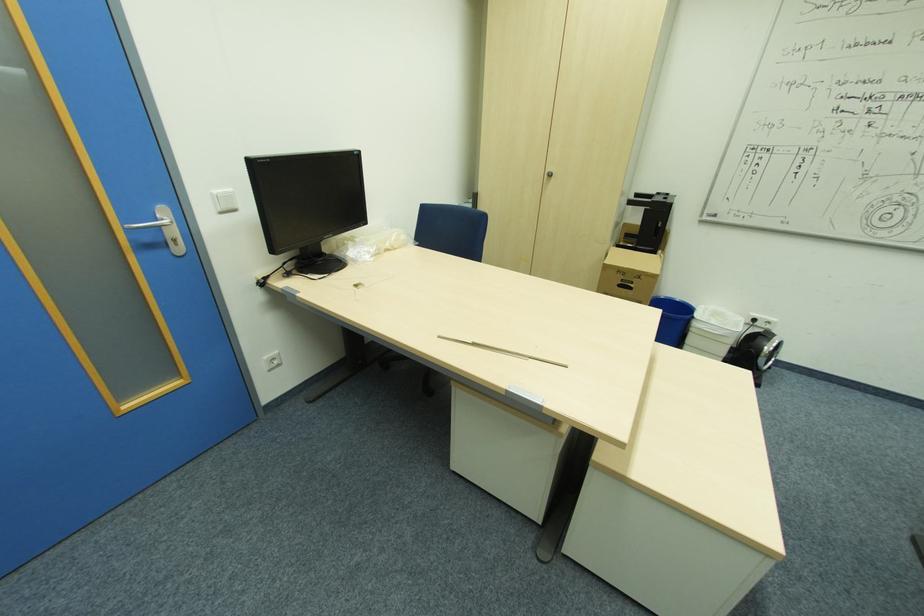
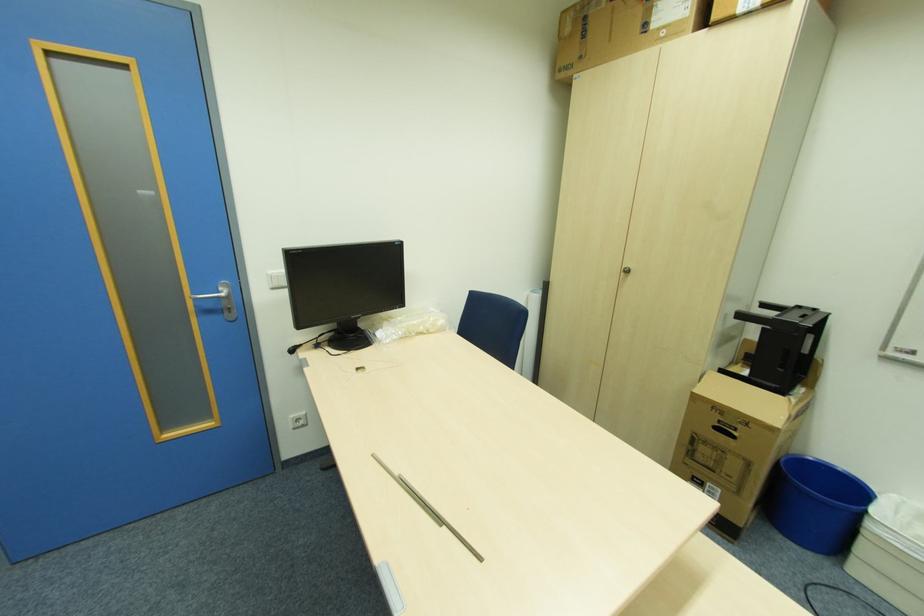
The point at (178,245) is marked in the first image. Where is the corresponding point in the second image?

(234, 310)